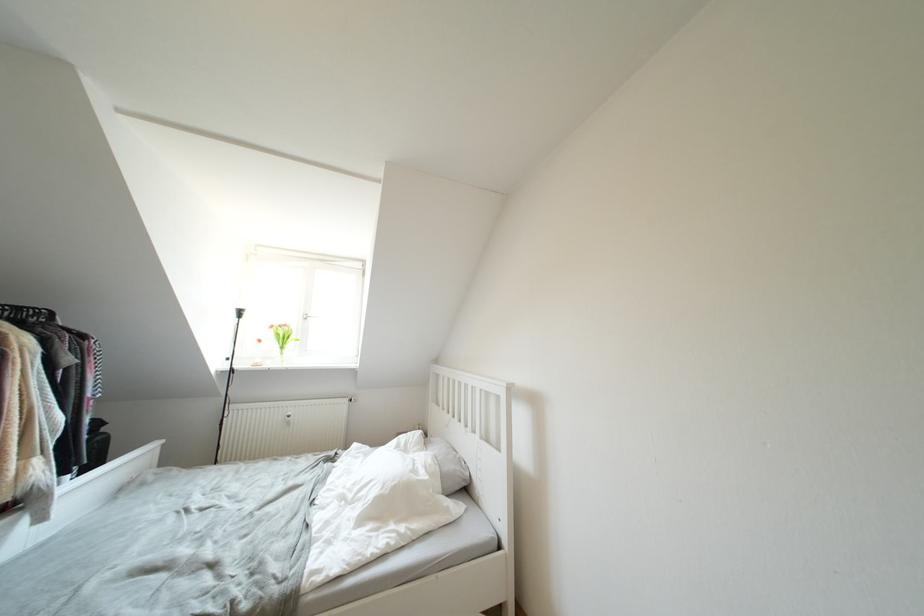
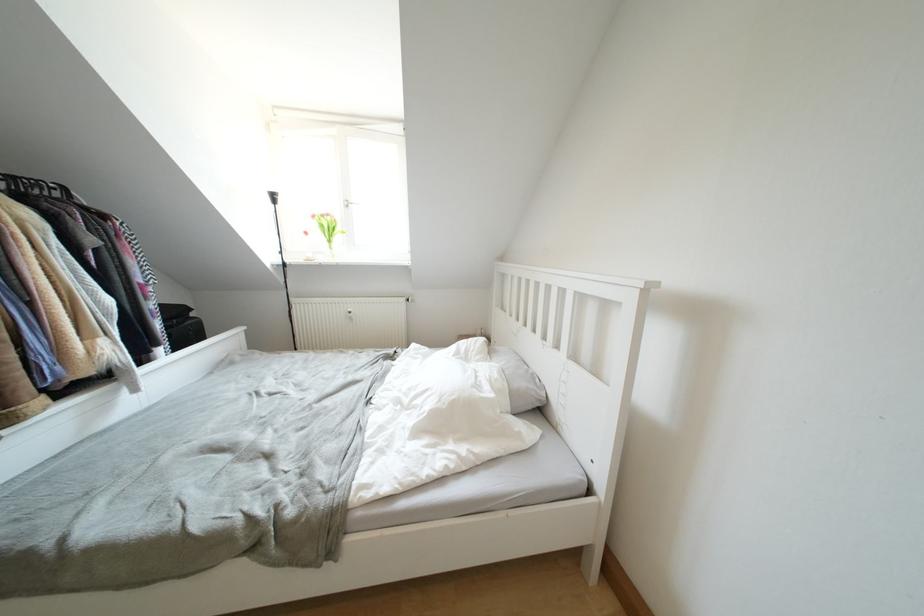
In the second image, find the point that corresponds to point 456,471 in the first image.

(527, 387)